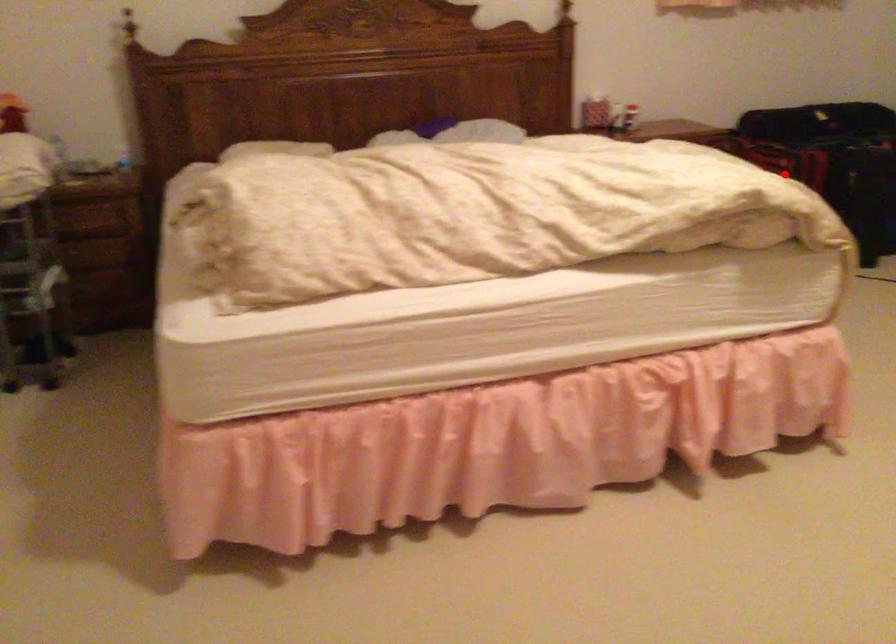
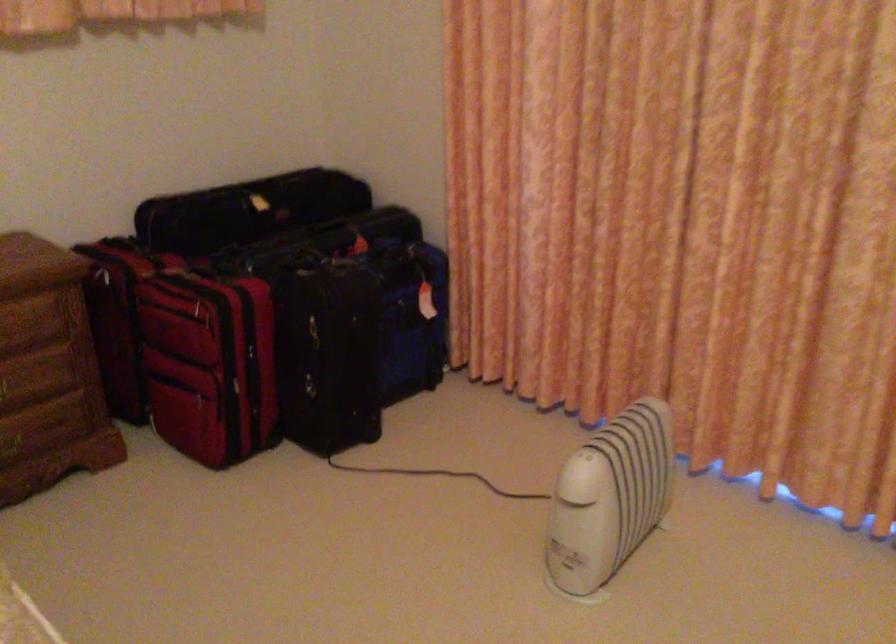
Question: I am providing you with two images of the same scene from different viewpoints. A red point is shown in image1. For the corresponding object point in image2, is it positioned nearer or farther from the camera?

Choices:
 (A) Nearer
 (B) Farther

Answer: (A)